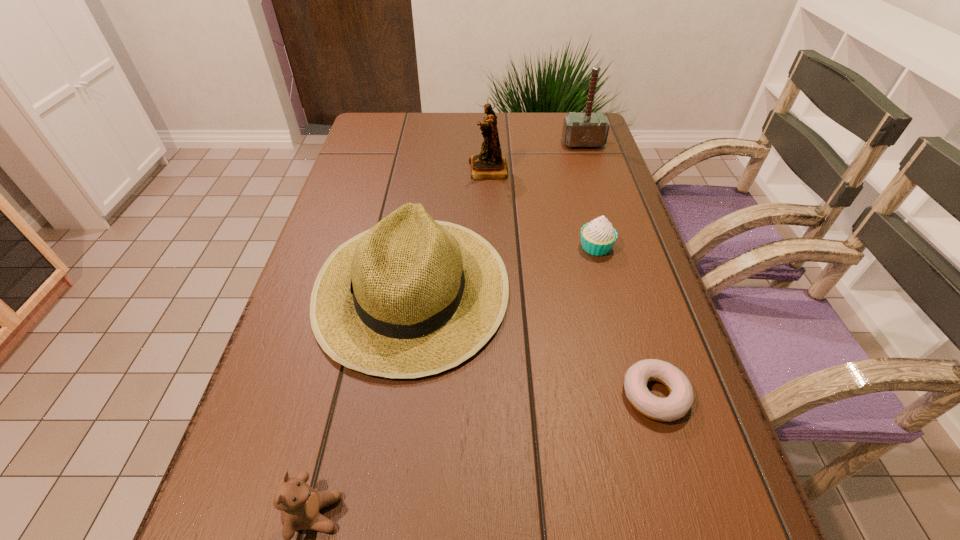
The image size is (960, 540). I want to click on free space at the far left corner of the desktop, so click(x=364, y=142).

The width and height of the screenshot is (960, 540). Find the location of `vacant space at the far right corner of the desktop`. vacant space at the far right corner of the desktop is located at coordinates (560, 148).

Identify the location of free point between the fifth nearest object and the cupcake. The width and height of the screenshot is (960, 540). (541, 208).

You are a GUI agent. You are given a task and a screenshot of the screen. Output one action in this format:
    pyautogui.click(x=<x>, y=<y>)
    Task: Click on the vacant area between the farthest object and the sunhat
    The image size is (960, 540).
    Given the screenshot: What is the action you would take?
    pyautogui.click(x=497, y=215)

At what (x,y) coordinates should I click in order to perform the action: click on object that is the closest one to the farthest object. Please return your answer as a coordinate pair (x, y). This screenshot has width=960, height=540. Looking at the image, I should click on (490, 164).

Identify the location of object that is the second closest to the figurine. The height and width of the screenshot is (540, 960). (587, 129).

This screenshot has height=540, width=960. Find the location of `free location that satisfies the following two spatial constraints: 1. on the front-facing side of the shortest object; 2. on the right side of the fifth nearest object`. free location that satisfies the following two spatial constraints: 1. on the front-facing side of the shortest object; 2. on the right side of the fifth nearest object is located at coordinates 493,395.

Image resolution: width=960 pixels, height=540 pixels. In order to click on vacant area in the image that satisfies the following two spatial constraints: 1. on the front side of the farthest object; 2. on the front-facing side of the figurine in this screenshot , I will do `click(591, 170)`.

The width and height of the screenshot is (960, 540). In order to click on free location that satisfies the following two spatial constraints: 1. on the back side of the sunhat; 2. on the left side of the farthest object in this screenshot , I will do `click(432, 144)`.